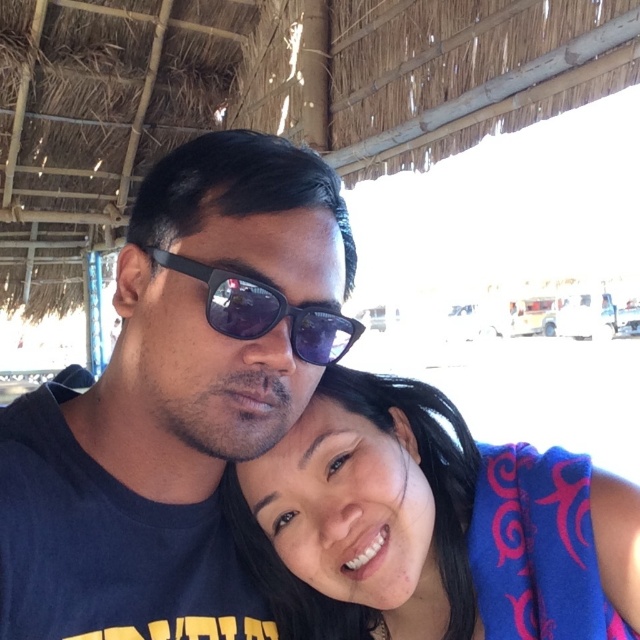
In the scene shown: Is matte black sunglasses at upper center below blue fabric towel at lower right?

Actually, matte black sunglasses at upper center is above blue fabric towel at lower right.

What are the coordinates of `matte black sunglasses at upper center` in the screenshot? It's located at (177, 401).

Which is behind, point (264, 580) or point (211, 289)?

Positioned behind is point (264, 580).

Between blue fabric towel at lower right and black matte sunglasses at center, which one has less height?

black matte sunglasses at center is shorter.

Is point (330, 636) positioned behind point (240, 300)?

That is True.

Locate an element on the screen. This screenshot has width=640, height=640. blue fabric towel at lower right is located at coordinates (429, 525).

Between matte black sunglasses at upper center and black matte sunglasses at center, which one is positioned higher?

Positioned higher is black matte sunglasses at center.

Is matte black sunglasses at upper center bigger than black matte sunglasses at center?

Indeed, matte black sunglasses at upper center has a larger size compared to black matte sunglasses at center.

Identify the location of matte black sunglasses at upper center. Image resolution: width=640 pixels, height=640 pixels. (177, 401).